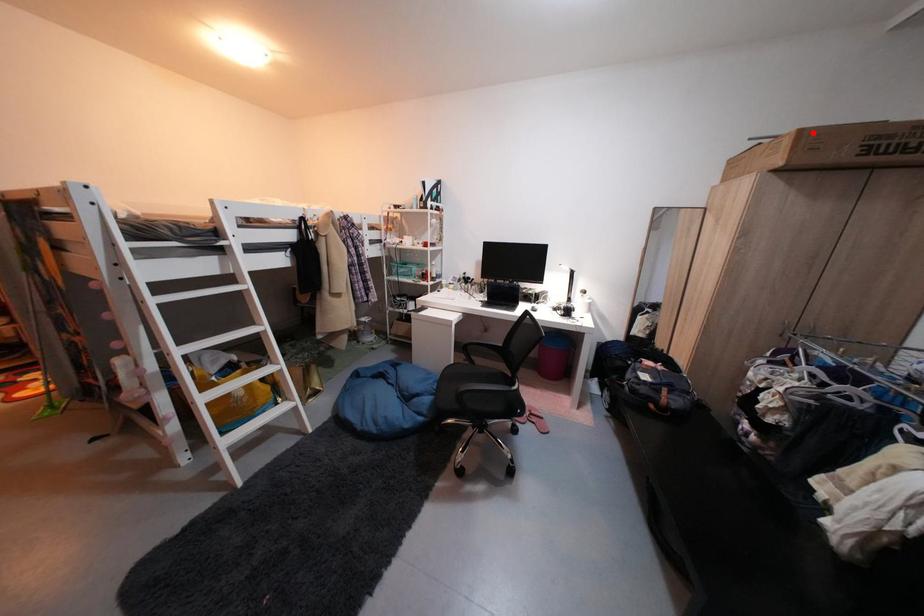
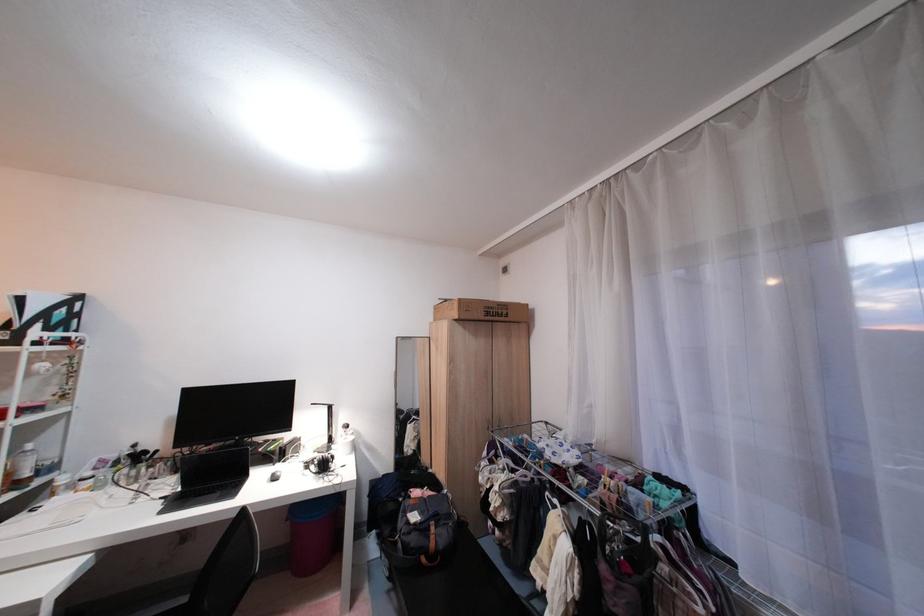
In the second image, find the point that corresponds to the highlighted location in the first image.

(470, 302)